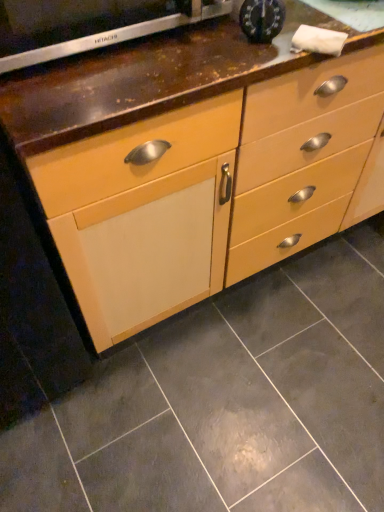
Question: Considering the positions of matte gray tile at center and satin silver oven at upper left, acting as the 2th appliance starting from the right, in the image, is matte gray tile at center bigger or smaller than satin silver oven at upper left, acting as the 2th appliance starting from the right,?

Choices:
 (A) big
 (B) small

Answer: (A)

Question: From a real-world perspective, is matte gray tile at center above or below satin silver oven at upper left, marked as the first appliance in a left-to-right arrangement?

Choices:
 (A) below
 (B) above

Answer: (A)

Question: Estimate the real-world distances between objects in this image. Which object is closer to the satin silver oven at upper left, acting as the 2th appliance starting from the right?

Choices:
 (A) metallic clock at upper center, acting as the second appliance starting from the left
 (B) matte gray tile at center
 (C) matte wood chest of drawers at center

Answer: (A)

Question: Which object is positioned farthest from the satin silver oven at upper left, marked as the first appliance in a left-to-right arrangement?

Choices:
 (A) metallic clock at upper center, which ranks as the 1th appliance in right-to-left order
 (B) matte gray tile at center
 (C) matte wood chest of drawers at center

Answer: (B)